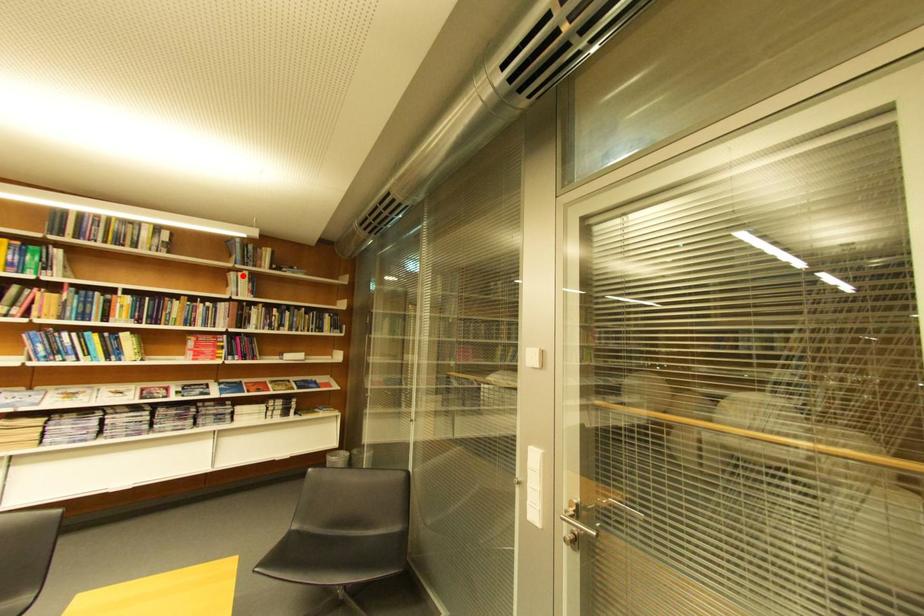
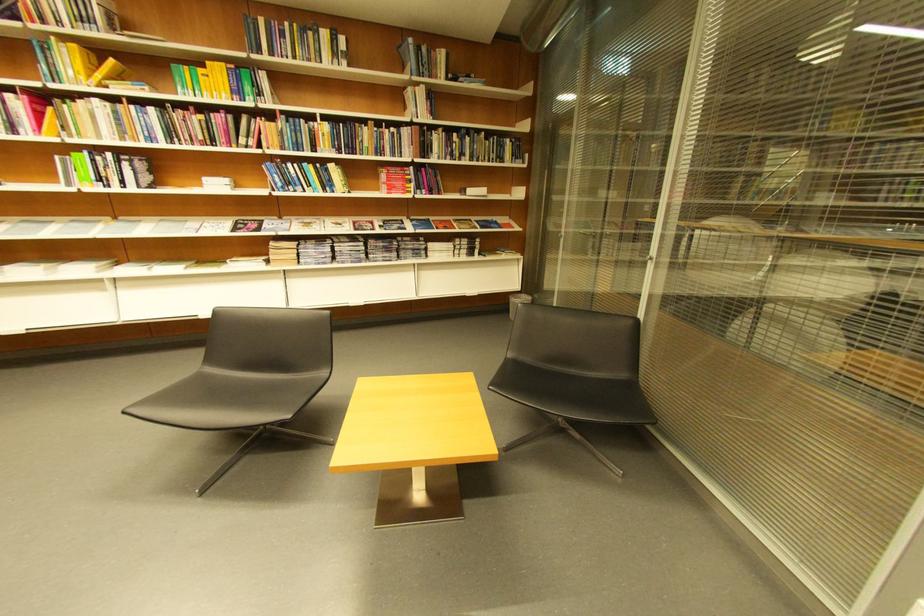
Question: I am providing you with two images of the same scene from different viewpoints. A red point is shown in image1. For the corresponding object point in image2, is it positioned nearer or farther from the camera?

Choices:
 (A) Nearer
 (B) Farther

Answer: (A)